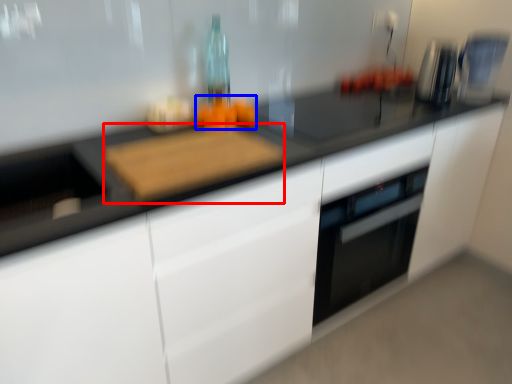
Question: Which object appears farthest to the camera in this image, cutting board (highlighted by a red box) or food (highlighted by a blue box)?

Choices:
 (A) cutting board
 (B) food

Answer: (B)